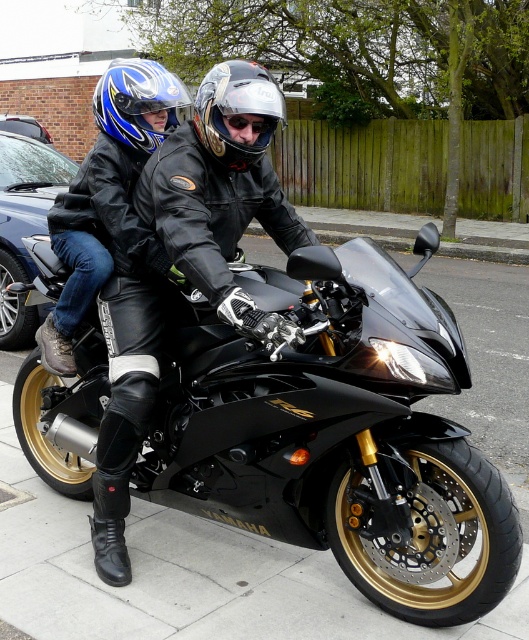
You are a photographer standing on the sidewalk. You want to take a photo of the black leather jacket at center and the black matte motorcycle at center. Which object is closer to the camera? Please explain your reasoning based on the scene description.

The black leather jacket at center is closer to the camera because the black matte motorcycle at center is positioned under it, indicating that the jacket is above the motorcycle in the scene.